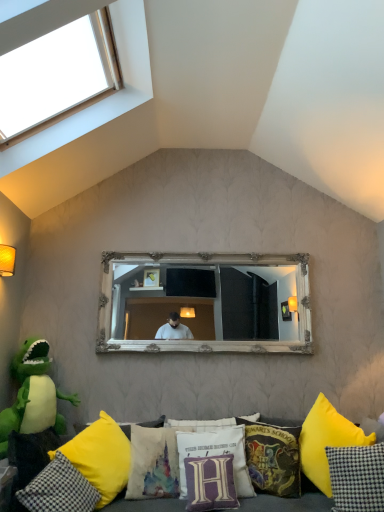
Question: Based on their positions, is clear glass window at upper left located to the left or right of checkered fabric pillow at lower right, positioned as the eighth pillow in left-to-right order?

Choices:
 (A) right
 (B) left

Answer: (B)

Question: In terms of size, does clear glass window at upper left appear bigger or smaller than checkered fabric pillow at lower right, which is the 1th pillow from right to left?

Choices:
 (A) small
 (B) big

Answer: (B)

Question: Based on their relative distances, which object is nearer to the yellow fabric couch at lower center?

Choices:
 (A) white ornate mirror at center
 (B) yellow fabric pillow at lower right, the second pillow from the right
 (C) yellow fabric pillow at lower center, positioned as the 7th pillow in right-to-left order
 (D) white fabric pillow with purple lettering at center, marked as the fourth pillow in a right-to-left arrangement
 (E) checkered fabric pillow at lower right, positioned as the eighth pillow in left-to-right order

Answer: (C)

Question: Considering the real-world distances, which object is closest to the yellow fabric pillow at lower left, the 1th pillow in the left-to-right sequence?

Choices:
 (A) yellow fabric couch at lower center
 (B) checkered fabric pillow at lower right, positioned as the eighth pillow in left-to-right order
 (C) yellow fabric pillow at lower center, which appears as the second pillow when viewed from the left
 (D) velvet hogwarts school crest pillow at center, the 3th pillow from the right
 (E) white ornate mirror at center

Answer: (C)